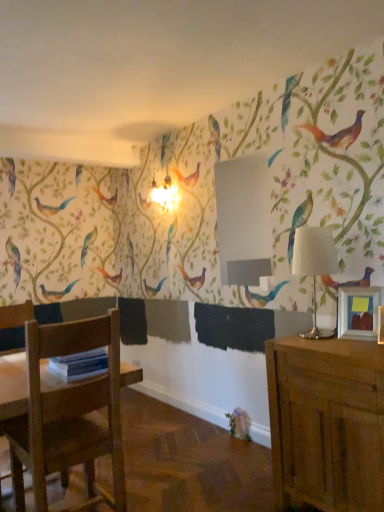
Question: Is wooden picture frame at right positioned far away from wooden chair at lower left?

Choices:
 (A) no
 (B) yes

Answer: (B)

Question: Does wooden picture frame at right contain wooden chair at lower left?

Choices:
 (A) yes
 (B) no

Answer: (B)

Question: From a real-world perspective, is wooden picture frame at right physically below wooden chair at lower left?

Choices:
 (A) no
 (B) yes

Answer: (A)

Question: Does wooden picture frame at right have a larger size compared to wooden chair at lower left?

Choices:
 (A) no
 (B) yes

Answer: (A)

Question: Considering the relative sizes of wooden picture frame at right and wooden chair at lower left in the image provided, is wooden picture frame at right smaller than wooden chair at lower left?

Choices:
 (A) no
 (B) yes

Answer: (B)

Question: From their relative heights in the image, would you say white fabric lampshade at right is taller or shorter than wooden chair at lower left?

Choices:
 (A) short
 (B) tall

Answer: (A)

Question: Choose the correct answer: Is white fabric lampshade at right inside wooden chair at lower left or outside it?

Choices:
 (A) outside
 (B) inside

Answer: (A)

Question: From the image's perspective, is white fabric lampshade at right located above or below wooden chair at lower left?

Choices:
 (A) above
 (B) below

Answer: (A)

Question: From a real-world perspective, relative to wooden chair at lower left, is white fabric lampshade at right vertically above or below?

Choices:
 (A) above
 (B) below

Answer: (A)

Question: Visually, is wooden cabinet at right positioned to the left or to the right of white fabric lampshade at right?

Choices:
 (A) right
 (B) left

Answer: (A)

Question: From a real-world perspective, is wooden cabinet at right physically located above or below white fabric lampshade at right?

Choices:
 (A) above
 (B) below

Answer: (B)

Question: In terms of width, does wooden cabinet at right look wider or thinner when compared to white fabric lampshade at right?

Choices:
 (A) thin
 (B) wide

Answer: (B)

Question: Is wooden cabinet at right bigger or smaller than white fabric lampshade at right?

Choices:
 (A) big
 (B) small

Answer: (A)

Question: Considering the positions of wooden chair at lower left and wooden cabinet at right in the image, is wooden chair at lower left bigger or smaller than wooden cabinet at right?

Choices:
 (A) small
 (B) big

Answer: (A)

Question: Considering the positions of wooden chair at lower left and wooden cabinet at right in the image, is wooden chair at lower left wider or thinner than wooden cabinet at right?

Choices:
 (A) thin
 (B) wide

Answer: (B)